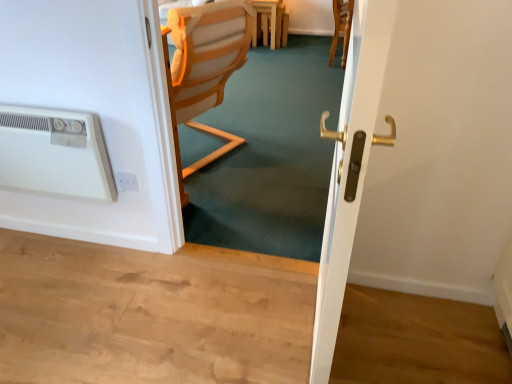
Where is `wooden chair at center`? wooden chair at center is located at coordinates (204, 68).

I want to click on white plastic electric outlet at lower left, so click(126, 181).

This screenshot has height=384, width=512. I want to click on white plastic air conditioning unit at left, so click(x=54, y=153).

Where is `wooden chair at center`? wooden chair at center is located at coordinates (204, 68).

Which object is closer to the camera taking this photo, white glossy door handle at center or white plastic air conditioning unit at left?

Positioned in front is white glossy door handle at center.

Is white glossy door handle at center facing away from white plastic air conditioning unit at left?

No, white glossy door handle at center is not facing away from white plastic air conditioning unit at left.

From a real-world perspective, between white glossy door handle at center and white plastic air conditioning unit at left, who is vertically lower?

From a 3D spatial view, white plastic air conditioning unit at left is below.

Is white glossy door handle at center wider or thinner than white plastic air conditioning unit at left?

In the image, white glossy door handle at center appears to be wider than white plastic air conditioning unit at left.

Between white plastic air conditioning unit at left and wooden chair at center, which one is positioned in front?

white plastic air conditioning unit at left.

Choose the correct answer: Is white plastic air conditioning unit at left inside wooden chair at center or outside it?

white plastic air conditioning unit at left exists outside the volume of wooden chair at center.

Is white plastic air conditioning unit at left facing away from wooden chair at center?

Correct, white plastic air conditioning unit at left is looking away from wooden chair at center.

From the image's perspective, which is above, white plastic air conditioning unit at left or wooden chair at center?

wooden chair at center, from the image's perspective.

Is point (324, 135) closer or farther from the camera than point (128, 173)?

Point (324, 135) appears to be closer to the viewer than point (128, 173).

From the image's perspective, which is above, white glossy door handle at center or white plastic electric outlet at lower left?

white plastic electric outlet at lower left is shown above in the image.

Consider the image. From a real-world perspective, which is physically above, white glossy door handle at center or white plastic electric outlet at lower left?

white glossy door handle at center, from a real-world perspective.

Where is `screen door below the white plastic electric outlet at lower left (from the image's perspective)`? screen door below the white plastic electric outlet at lower left (from the image's perspective) is located at coordinates (350, 167).

Based on their positions, is wooden chair at center located to the left or right of white glossy door handle at center?

Based on their positions, wooden chair at center is located to the left of white glossy door handle at center.

Is white glossy door handle at center completely or partially inside wooden chair at center?

Definitely not — white glossy door handle at center is not inside wooden chair at center.

From the image's perspective, is wooden chair at center over white glossy door handle at center?

Yes.

From a real-world perspective, is wooden chair at center located beneath white glossy door handle at center?

Yes, from a real-world perspective, wooden chair at center is beneath white glossy door handle at center.

Which of these two, light brown wooden table at center or white plastic air conditioning unit at left, is bigger?

Bigger between the two is white plastic air conditioning unit at left.

How many degrees apart are the facing directions of light brown wooden table at center and white plastic air conditioning unit at left?

The facing directions of light brown wooden table at center and white plastic air conditioning unit at left are 4.82 degrees apart.

Between light brown wooden table at center and white plastic air conditioning unit at left, which one has less height?

white plastic air conditioning unit at left is shorter.

This screenshot has height=384, width=512. I want to click on air conditioning that appears on the left of light brown wooden table at center, so click(54, 153).

From a real-world perspective, who is located lower, white plastic electric outlet at lower left or wooden chair at center?

white plastic electric outlet at lower left, from a real-world perspective.

Does white plastic electric outlet at lower left come in front of wooden chair at center?

Yes, it is in front of wooden chair at center.

Can you see white plastic electric outlet at lower left touching wooden chair at center?

They are not placed beside each other.

Between white plastic electric outlet at lower left and wooden chair at center, which one has less height?

With less height is white plastic electric outlet at lower left.

Would you say wooden chair at center is a long distance from white plastic air conditioning unit at left?

Actually, wooden chair at center and white plastic air conditioning unit at left are a little close together.

Where is `air conditioning below the wooden chair at center (from the image's perspective)`? This screenshot has height=384, width=512. air conditioning below the wooden chair at center (from the image's perspective) is located at coordinates (54, 153).

Considering the positions of objects wooden chair at center and white plastic air conditioning unit at left in the image provided, who is in front, wooden chair at center or white plastic air conditioning unit at left?

white plastic air conditioning unit at left is in front.

From the image's perspective, which one is positioned higher, wooden chair at center or white plastic air conditioning unit at left?

wooden chair at center is shown above in the image.

This screenshot has width=512, height=384. What are the coordinates of `air conditioning behind the white glossy door handle at center` in the screenshot? It's located at (54, 153).

The image size is (512, 384). I want to click on air conditioning that is above the wooden chair at center (from a real-world perspective), so click(x=54, y=153).

Which object lies nearer to the anchor point light brown wooden table at center, white plastic electric outlet at lower left or white glossy door handle at center?

white plastic electric outlet at lower left is positioned closer to the anchor light brown wooden table at center.

From the image, which object appears to be nearer to white plastic air conditioning unit at left, white plastic electric outlet at lower left or wooden chair at center?

white plastic electric outlet at lower left is closer to white plastic air conditioning unit at left.

Looking at the image, which one is located further to white glossy door handle at center, wooden chair at center or light brown wooden table at center?

Among the two, light brown wooden table at center is located further to white glossy door handle at center.

Based on their spatial positions, is white glossy door handle at center or wooden chair at center closer to white plastic air conditioning unit at left?

Based on the image, wooden chair at center appears to be nearer to white plastic air conditioning unit at left.

Which object lies nearer to the anchor point white plastic air conditioning unit at left, white glossy door handle at center or white plastic electric outlet at lower left?

white plastic electric outlet at lower left is closer to white plastic air conditioning unit at left.

Estimate the real-world distances between objects in this image. Which object is further from white plastic electric outlet at lower left, white plastic air conditioning unit at left or light brown wooden table at center?

The object further to white plastic electric outlet at lower left is light brown wooden table at center.

Estimate the real-world distances between objects in this image. Which object is further from white plastic electric outlet at lower left, wooden chair at center or light brown wooden table at center?

light brown wooden table at center is further to white plastic electric outlet at lower left.

Which object lies further to the anchor point wooden chair at center, white plastic electric outlet at lower left or light brown wooden table at center?

light brown wooden table at center lies further to wooden chair at center than the other object.

Where is `air conditioning between white glossy door handle at center and wooden chair at center in the front-back direction`? Image resolution: width=512 pixels, height=384 pixels. air conditioning between white glossy door handle at center and wooden chair at center in the front-back direction is located at coordinates (54, 153).

The image size is (512, 384). Find the location of `chair located between white plastic air conditioning unit at left and light brown wooden table at center in the depth direction`. chair located between white plastic air conditioning unit at left and light brown wooden table at center in the depth direction is located at coordinates (204, 68).

Identify the location of chair positioned between white glossy door handle at center and light brown wooden table at center from near to far. The height and width of the screenshot is (384, 512). (204, 68).

Where is `air conditioning between white glossy door handle at center and white plastic electric outlet at lower left in the front-back direction`? air conditioning between white glossy door handle at center and white plastic electric outlet at lower left in the front-back direction is located at coordinates (54, 153).